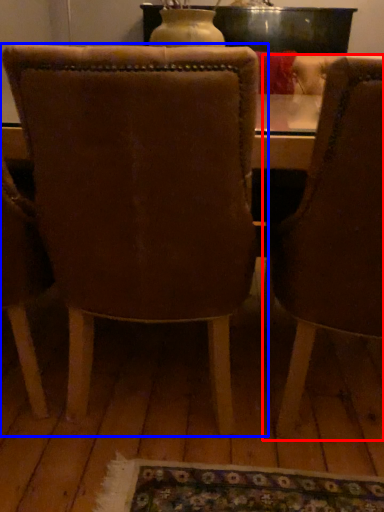
Question: Which object appears closest to the camera in this image, chair (highlighted by a red box) or chair (highlighted by a blue box)?

Choices:
 (A) chair
 (B) chair

Answer: (A)